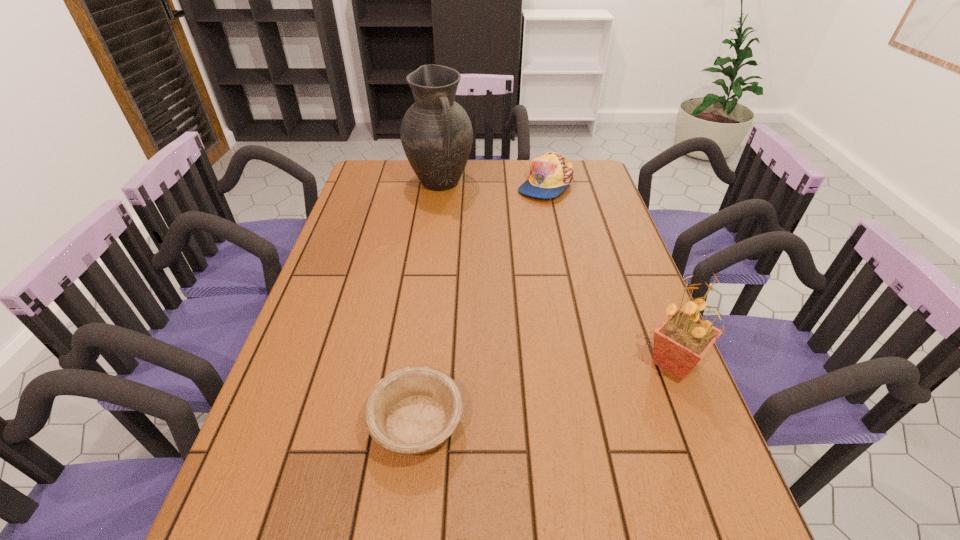
Where is `the shortest object`? the shortest object is located at coordinates (413, 410).

What are the coordinates of `the rightmost object` in the screenshot? It's located at (680, 342).

Find the location of a particular element. This screenshot has height=540, width=960. the second tallest object is located at coordinates (680, 342).

Identify the location of pitcher. (436, 134).

This screenshot has height=540, width=960. I want to click on cap, so click(x=551, y=173).

This screenshot has height=540, width=960. What are the coordinates of `the second object from right to left` in the screenshot? It's located at (551, 173).

Where is `vacant point located on the back of the shortest object`? This screenshot has width=960, height=540. vacant point located on the back of the shortest object is located at coordinates (425, 345).

This screenshot has height=540, width=960. What are the coordinates of `free location located 0.100m at the front of the second tallest object with flowers visible` in the screenshot? It's located at (600, 362).

You are a GUI agent. You are given a task and a screenshot of the screen. Output one action in this format:
    pyautogui.click(x=<x>, y=<y>)
    Task: Click on the free spot located at the front of the second tallest object with flowers visible
    The height and width of the screenshot is (540, 960).
    Given the screenshot: What is the action you would take?
    pyautogui.click(x=566, y=362)

You are a GUI agent. You are given a task and a screenshot of the screen. Output one action in this format:
    pyautogui.click(x=<x>, y=<y>)
    Task: Click on the free location located 0.360m at the front of the second tallest object with flowers visible
    Image resolution: width=960 pixels, height=540 pixels.
    Given the screenshot: What is the action you would take?
    pyautogui.click(x=490, y=362)